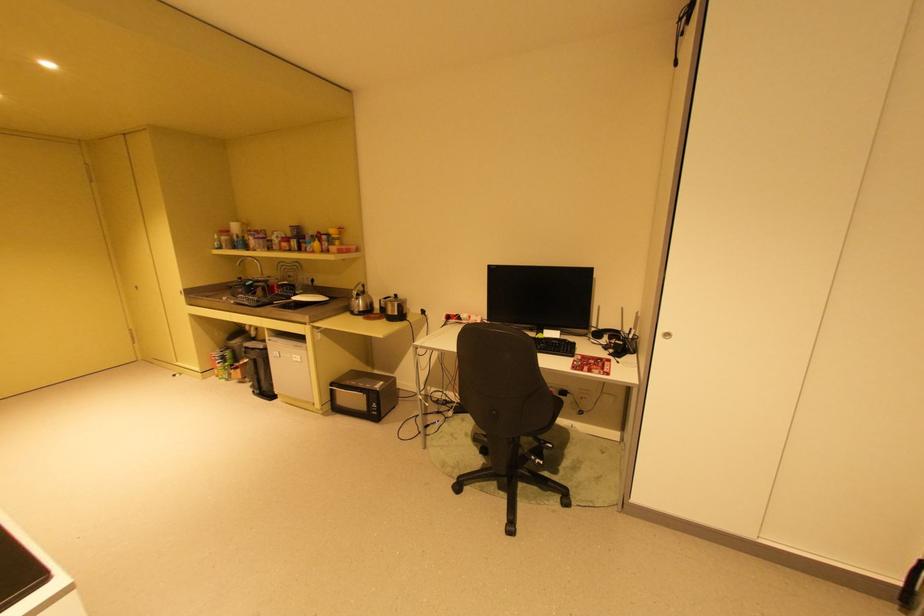
Where is `white plate`? The width and height of the screenshot is (924, 616). white plate is located at coordinates (310, 297).